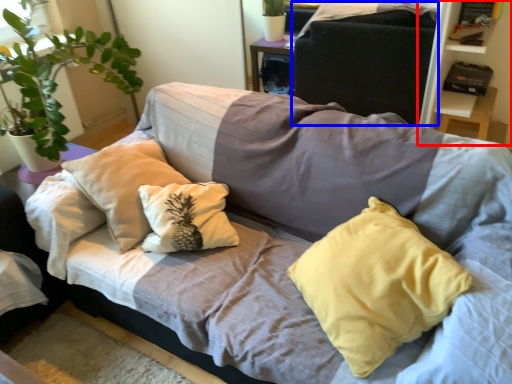
Question: Among these objects, which one is nearest to the camera, bookshelf (highlighted by a red box) or gray (highlighted by a blue box)?

Choices:
 (A) bookshelf
 (B) gray

Answer: (A)